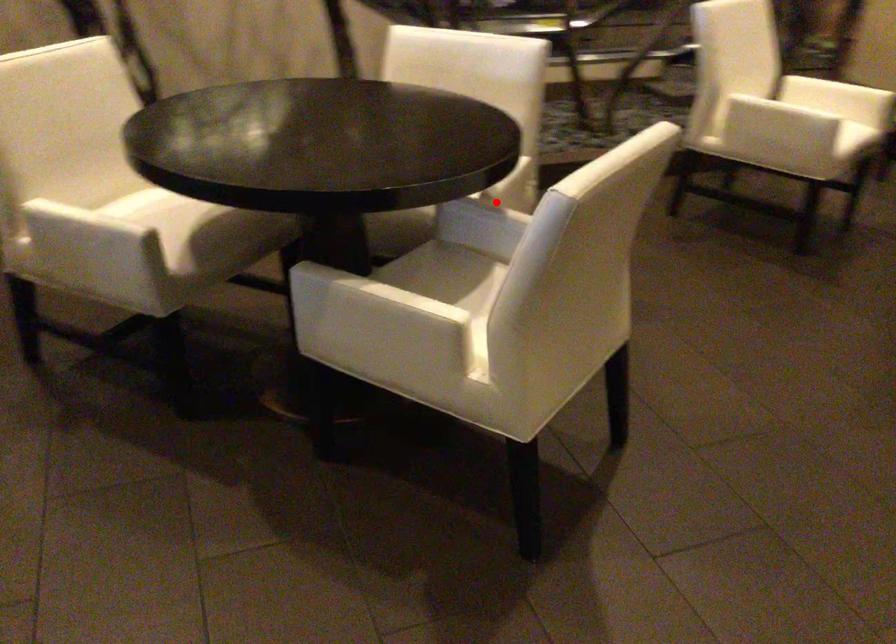
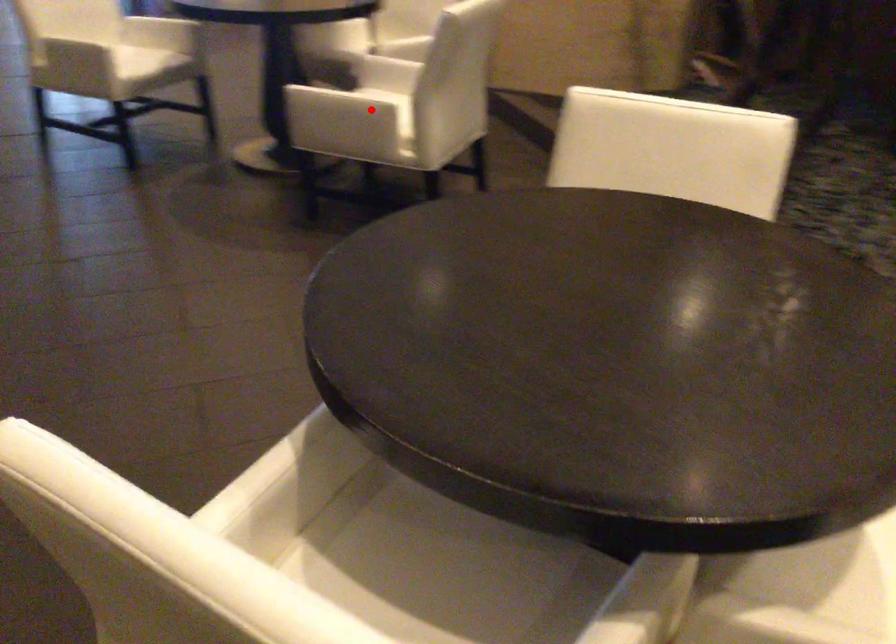
I am providing you with two images of the same scene from different viewpoints. A red point is marked on the first image and another point is marked on the second image. Does the point marked in image1 correspond to the same location as the one in image2?

No